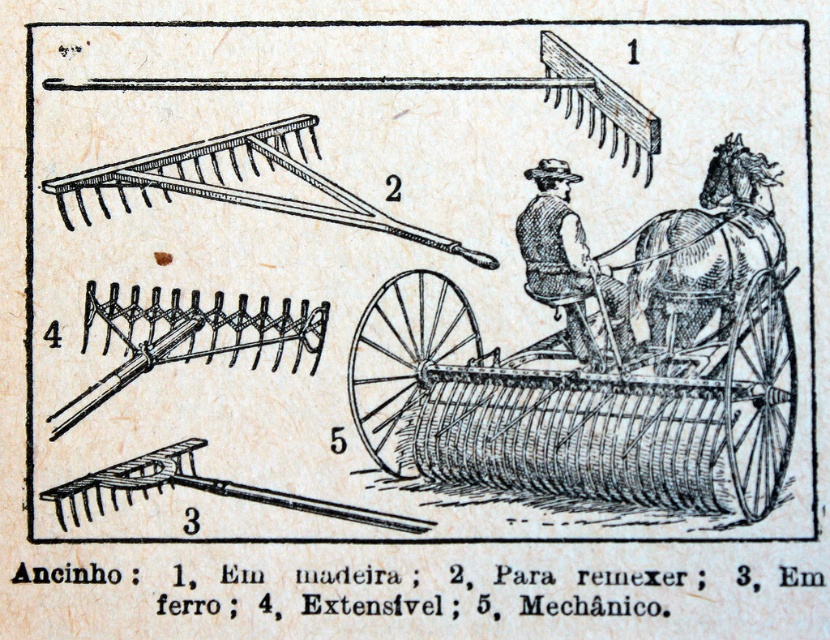
Is wooden cart at center positioned before brown textured horse at upper right?

Yes, wooden cart at center is in front of brown textured horse at upper right.

Can you confirm if wooden cart at center is positioned to the right of brown textured horse at upper right?

No, wooden cart at center is not to the right of brown textured horse at upper right.

Is point (785, 451) closer to camera compared to point (702, 340)?

Yes, point (785, 451) is in front of point (702, 340).

Locate an element on the screen. Image resolution: width=830 pixels, height=640 pixels. wooden cart at center is located at coordinates [x=581, y=404].

Can you confirm if brown textured horse at upper right is positioned above brown leather vest at center?

Yes.

Who is more forward, [701,273] or [560,288]?

Point [701,273]

The height and width of the screenshot is (640, 830). I want to click on brown textured horse at upper right, so click(x=706, y=253).

Can you confirm if wooden cart at center is positioned below brown leather vest at center?

Yes, wooden cart at center is below brown leather vest at center.

Can you confirm if wooden cart at center is positioned to the left of brown leather vest at center?

Incorrect, wooden cart at center is not on the left side of brown leather vest at center.

This screenshot has width=830, height=640. Describe the element at coordinates (581, 404) in the screenshot. I see `wooden cart at center` at that location.

Identify the location of wooden cart at center. (581, 404).